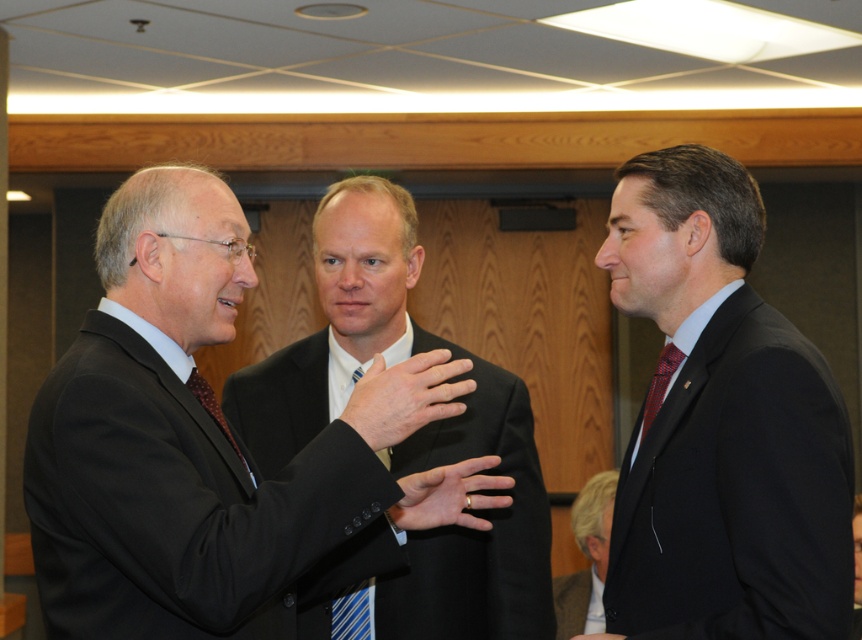
What do you see at coordinates (405, 396) in the screenshot?
I see `smooth black suit at center` at bounding box center [405, 396].

Who is higher up, smooth black suit at center or dark gray suit at lower right?

Positioned higher is smooth black suit at center.

Is point (458, 404) more distant than point (576, 628)?

No, (458, 404) is in front of (576, 628).

At what (x,y) coordinates should I click in order to perform the action: click on smooth black suit at center. Please return your answer as a coordinate pair (x, y). Image resolution: width=862 pixels, height=640 pixels. Looking at the image, I should click on (405, 396).

Between light brown leather jacket at lower right and matte black hand at center, which one has less height?

Standing shorter between the two is matte black hand at center.

Does light brown leather jacket at lower right appear under matte black hand at center?

Correct, light brown leather jacket at lower right is located below matte black hand at center.

At what (x,y) coordinates should I click in order to perform the action: click on light brown leather jacket at lower right. Please return your answer as a coordinate pair (x, y). This screenshot has height=640, width=862. Looking at the image, I should click on (586, 557).

Between matte black suit at right and matte black suit at center, which one appears on the left side from the viewer's perspective?

Positioned to the left is matte black suit at center.

Does matte black suit at right have a lesser height compared to matte black suit at center?

Correct, matte black suit at right is not as tall as matte black suit at center.

Is point (684, 515) farther from camera compared to point (500, 404)?

No, (684, 515) is in front of (500, 404).

Identify the location of matte black suit at right. (722, 424).